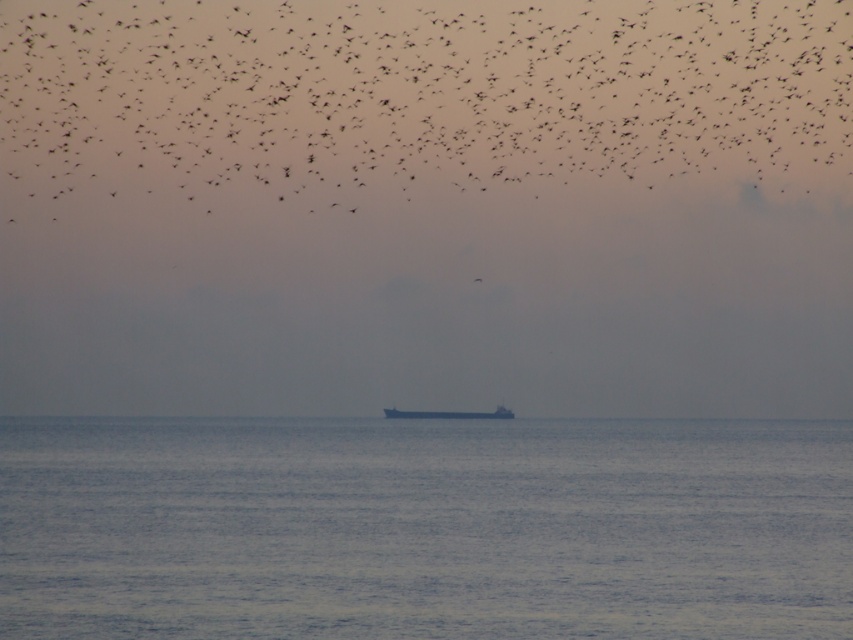
You are a birdwatcher observing the scene. You notice the black matte birds at upper center and the gray metallic ship at center. Which object appears taller in the image?

The black matte birds at upper center has a greater height compared to the gray metallic ship at center, so the black matte birds at upper center appears taller in the image.

Consider the image. You are a sailor navigating a small boat in the middle of the ocean. You see the point at coordinates (x=424, y=529) and the blue matte water at center. Which one is the water you should avoid hitting?

The blue matte water at center is located at point (x=424, y=529), so you should avoid hitting the blue matte water at center as it is the water at that location.

You are a birdwatcher observing the black matte birds at upper center and the black matte bird at upper center in the sky. Which group has a higher position in the sky?

The black matte birds at upper center has a greater height compared to the black matte bird at upper center, so the group of black matte birds at upper center is higher in the sky.